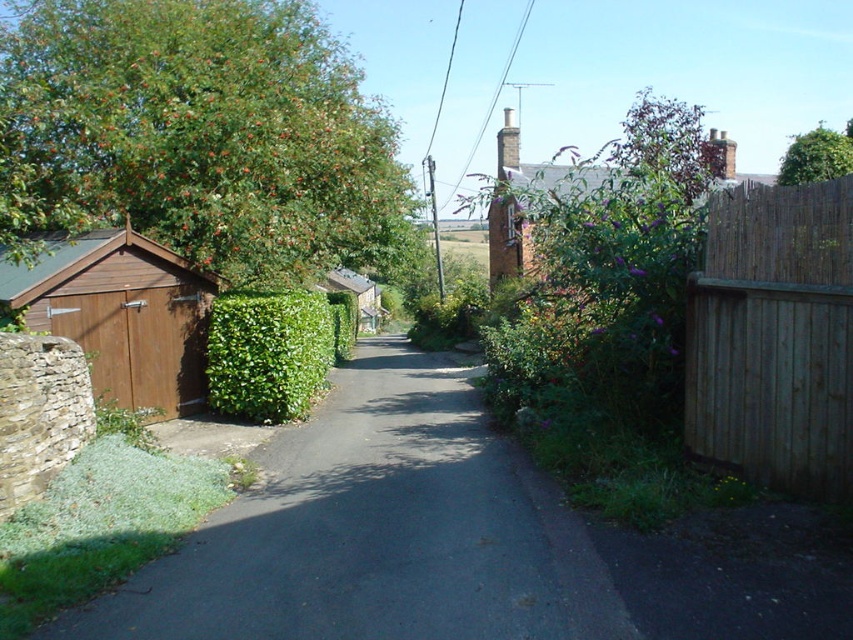
Between brown wooden shed at left and green leafy hedge at center, which one has less height?

Standing shorter between the two is green leafy hedge at center.

This screenshot has height=640, width=853. Identify the location of brown wooden shed at left. (120, 314).

Between green leafy bush at upper right and green leafy tree at upper right, which one has less height?

With less height is green leafy tree at upper right.

Between point (503, 214) and point (830, 152), which one is positioned behind?

The point (503, 214) is behind.

Where is `green leafy bush at upper right`? green leafy bush at upper right is located at coordinates (521, 202).

Can you confirm if brown wooden fence at right is positioned above brown wooden shed at left?

Actually, brown wooden fence at right is below brown wooden shed at left.

Between brown wooden fence at right and brown wooden shed at left, which one appears on the left side from the viewer's perspective?

→ brown wooden shed at left is more to the left.

Does point (695, 272) come farther from viewer compared to point (149, 339)?

No, it is in front of (149, 339).

The image size is (853, 640). I want to click on brown wooden fence at right, so click(775, 337).